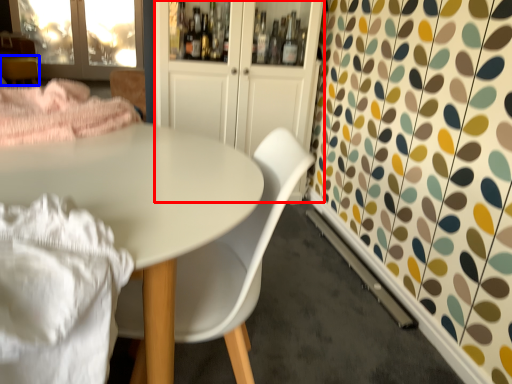
Question: Which object appears farthest to the camera in this image, dresser (highlighted by a red box) or side table (highlighted by a blue box)?

Choices:
 (A) dresser
 (B) side table

Answer: (B)